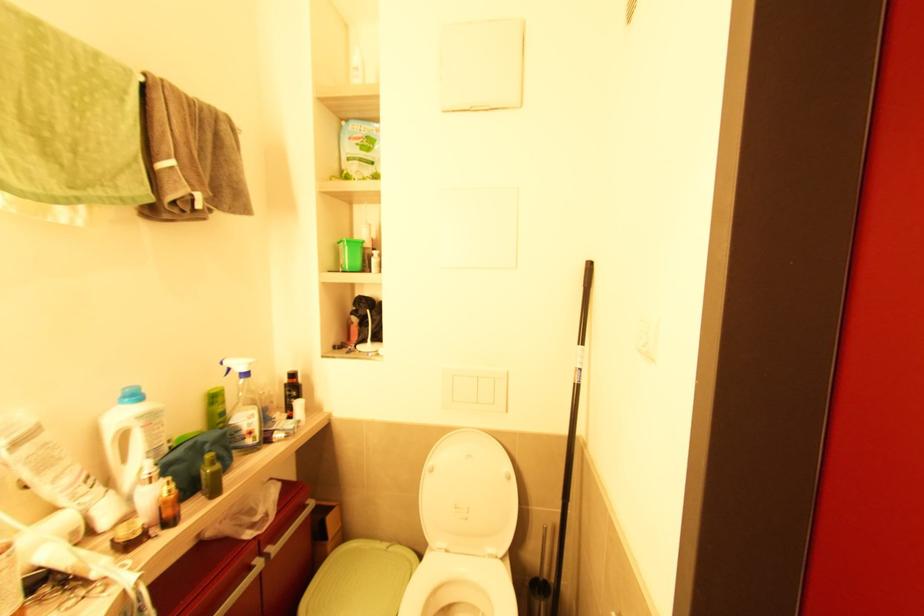
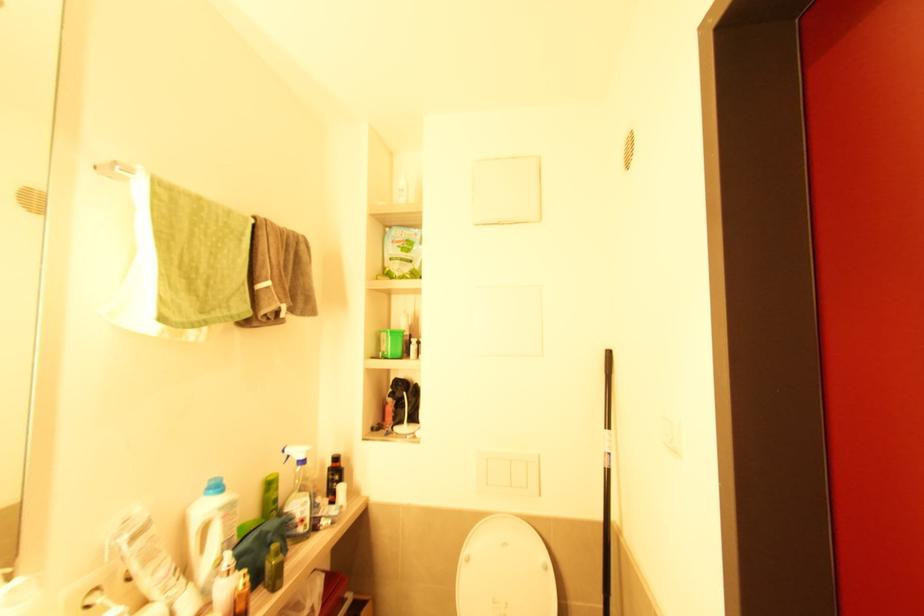
The point at (x=247, y=440) is marked in the first image. Where is the corresponding point in the second image?

(298, 527)